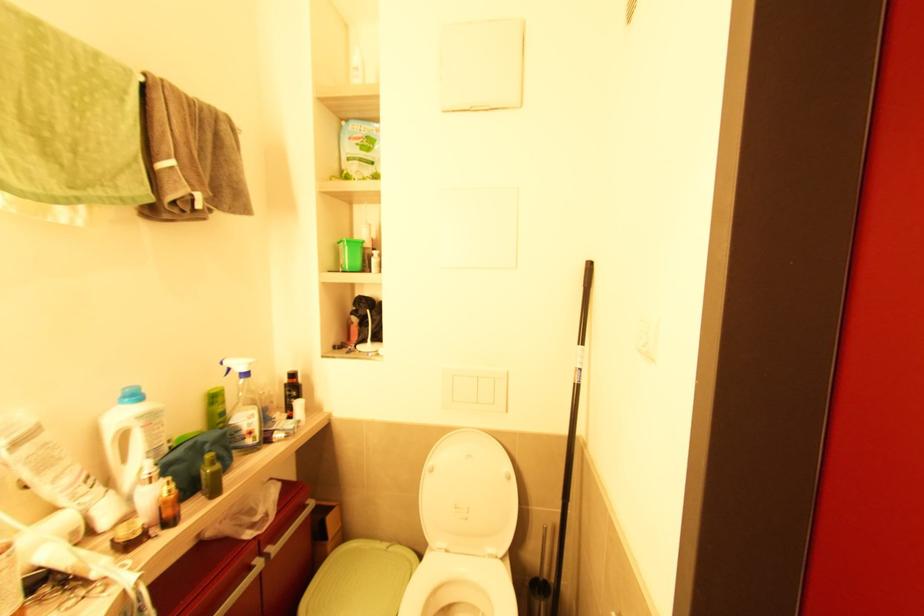
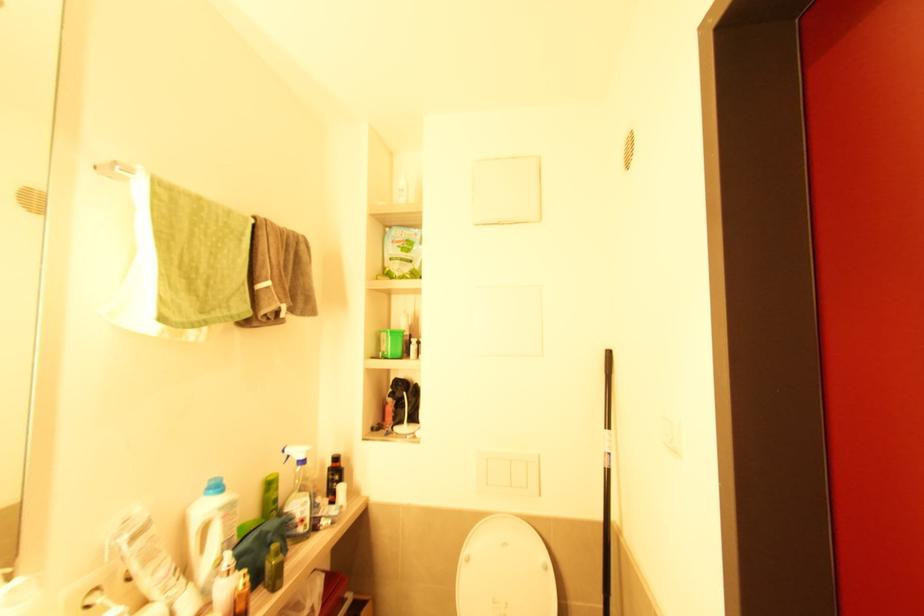
The point at (x=247, y=440) is marked in the first image. Where is the corresponding point in the second image?

(298, 527)